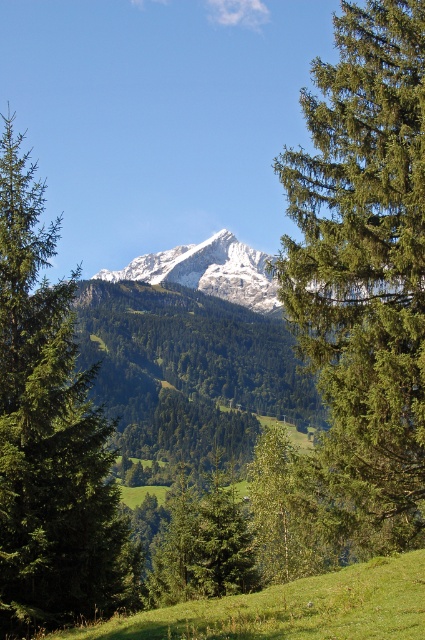
Is green needle-like at center smaller than green matte tree at center?

Correct, green needle-like at center occupies less space than green matte tree at center.

Is green needle-like at center below green matte tree at center?

Correct, green needle-like at center is located below green matte tree at center.

Who is more forward, (399, 275) or (85, 541)?

Point (399, 275) is in front.

At what (x,y) coordinates should I click in order to perform the action: click on green needle-like at center. Please return your answer as a coordinate pair (x, y). Looking at the image, I should click on (363, 272).